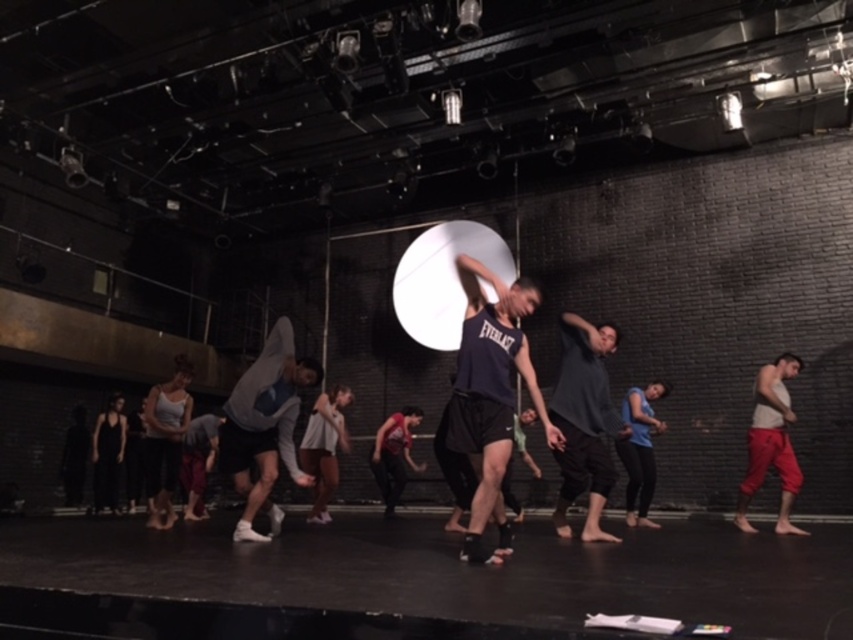
Can you confirm if white cotton tank top at right is positioned below black matte tank top at lower left?

No.

Does point (741, 492) come farther from viewer compared to point (97, 465)?

No, it is not.

Where is `white cotton tank top at right`? This screenshot has height=640, width=853. white cotton tank top at right is located at coordinates (770, 442).

Can you confirm if gray matte hoodie at center is positioned to the right of blue matte shirt at center?

Incorrect, gray matte hoodie at center is not on the right side of blue matte shirt at center.

Does gray matte hoodie at center have a greater width compared to blue matte shirt at center?

Indeed, gray matte hoodie at center has a greater width compared to blue matte shirt at center.

Image resolution: width=853 pixels, height=640 pixels. What are the coordinates of `gray matte hoodie at center` in the screenshot? It's located at (265, 426).

Does white matte shorts at center have a lesser width compared to matte red shirt at center?

Yes.

What are the coordinates of `white matte shorts at center` in the screenshot? It's located at (323, 445).

Who is more distant from viewer, [315,413] or [402,470]?

The point [402,470] is behind.

Where is `white matte shorts at center`? white matte shorts at center is located at coordinates (323, 445).